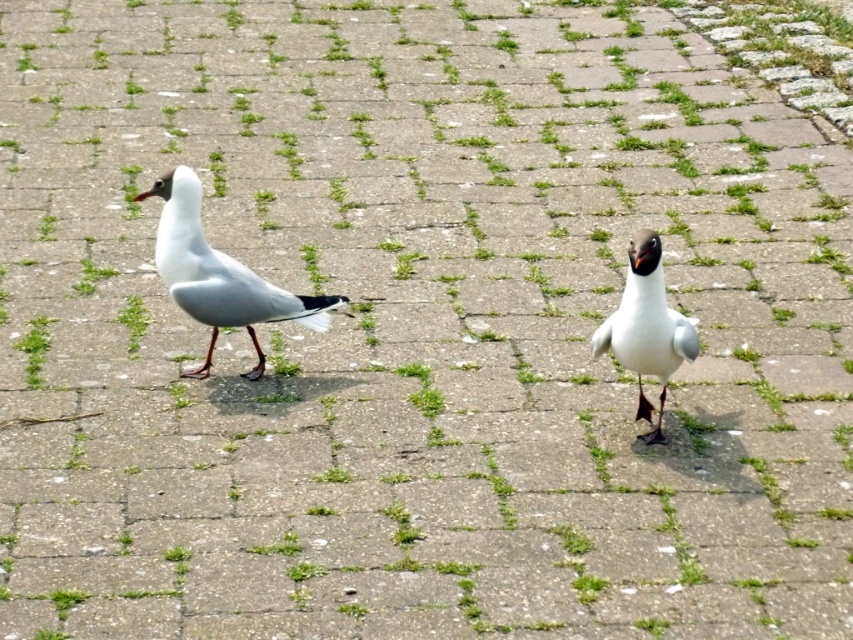
You are a photographer aiming to capture both the white matte bird at left and the white matte bird at center in a single shot. Considering their heights, which bird might be more challenging to frame properly without cropping?

The white matte bird at left is much taller than the white matte bird at center, so it might be more challenging to frame properly without cropping due to its greater height.

You are standing at a point 15.63 feet away from the point labeled as point (167,273) in the image. If you want to move closer to that point, which direction should you walk?

You should walk towards the point (167,273) because you are currently 15.63 feet away from it.

You are a photographer aiming to capture both seagulls in a single shot without moving the camera. Given that the white matte bird at left is 15.24 feet from the camera, can you confirm if the other seagull is within the camera frame?

The white matte bird at left is 15.24 feet from the camera. Since the other seagull is positioned closer to the camera than the white matte bird at left, it should be within the camera frame as long as the camera has a wide enough angle to include both subjects at their respective distances.